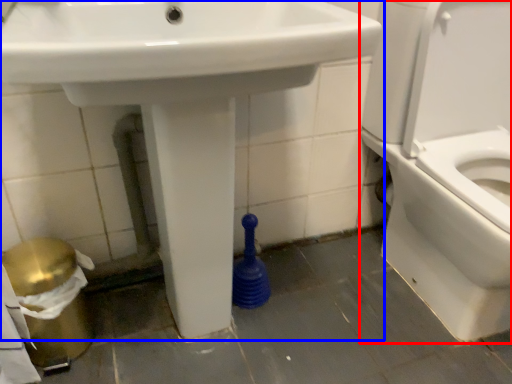
Question: Which point is closer to the camera, toilet (highlighted by a red box) or sink (highlighted by a blue box)?

Choices:
 (A) toilet
 (B) sink

Answer: (B)